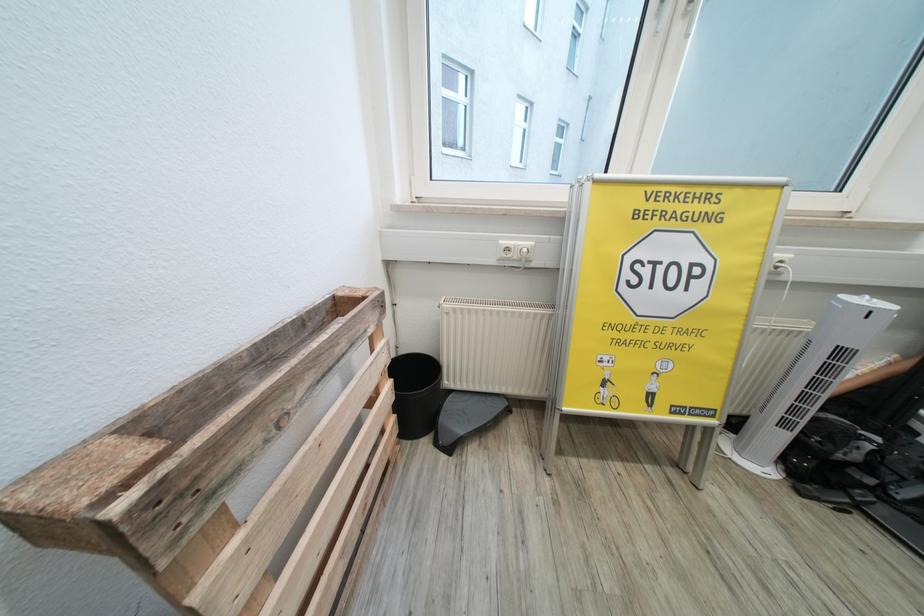
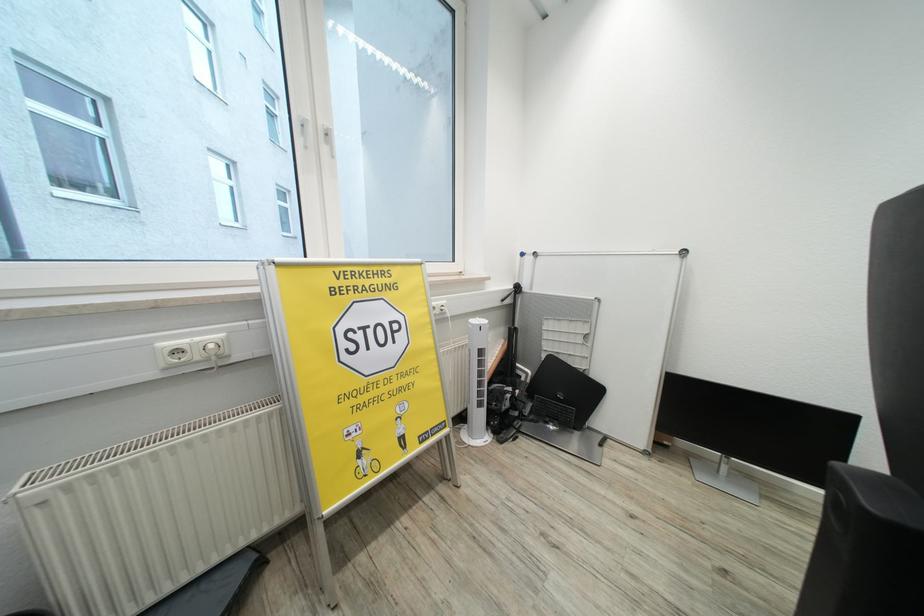
Question: The images are taken continuously from a first-person perspective. In which direction is your viewpoint rotating?

Choices:
 (A) Left
 (B) Right
 (C) Up
 (D) Down

Answer: (B)